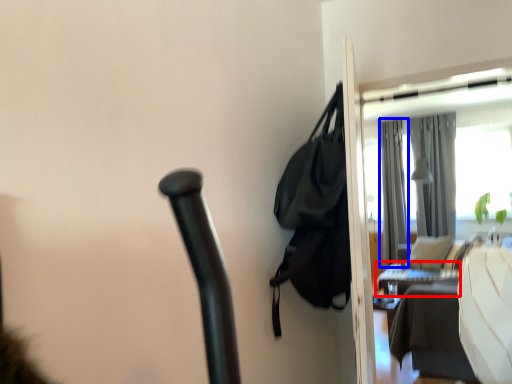
Question: Which object appears farthest to the camera in this image, table (highlighted by a red box) or curtain (highlighted by a blue box)?

Choices:
 (A) table
 (B) curtain

Answer: (B)